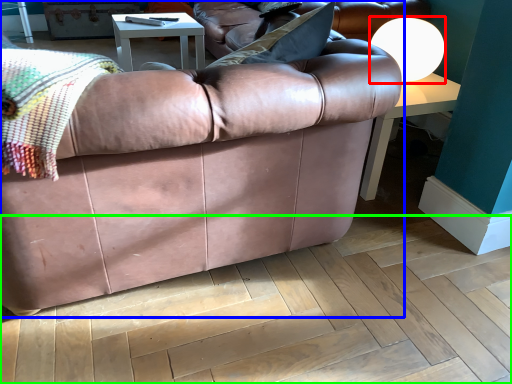
Question: Based on their relative distances, which object is farther from lamp (highlighted by a red box)? Choose from studio couch (highlighted by a blue box) and plywood (highlighted by a green box).

Choices:
 (A) studio couch
 (B) plywood

Answer: (B)